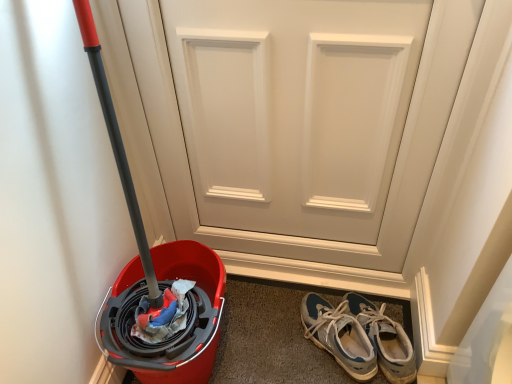
At what (x,y) coordinates should I click in order to perform the action: click on vacant space that is to the left of blue suede sneakers at lower right, the 1th footwear positioned from the left. Please return your answer as a coordinate pair (x, y). This screenshot has width=512, height=384. Looking at the image, I should click on (274, 341).